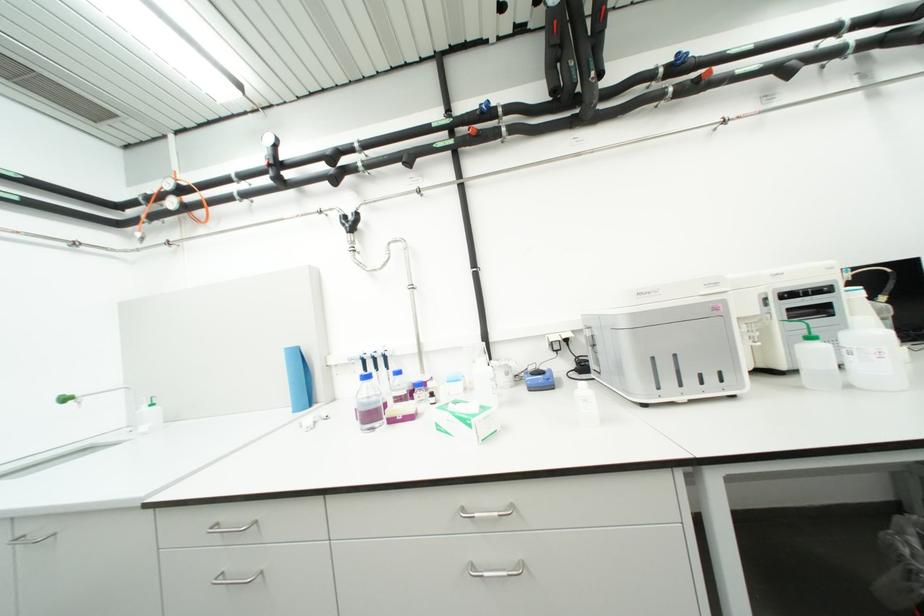
Image resolution: width=924 pixels, height=616 pixels. Find the location of `the left bottle with blue cap`. the left bottle with blue cap is located at coordinates (366, 400).